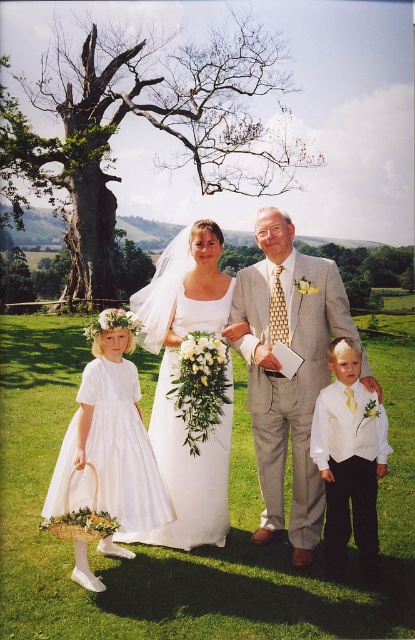
Does point (256, 214) lie behind point (348, 465)?

Yes.

Between light gray textured suit at center and white satin vest at lower right, which one appears on the left side from the viewer's perspective?

Positioned to the left is light gray textured suit at center.

Which is behind, point (310, 540) or point (334, 413)?

The point (310, 540) is behind.

This screenshot has height=640, width=415. I want to click on light gray textured suit at center, so click(x=283, y=374).

Does white satin dress at center have a greater width compared to light gray textured suit at center?

No.

Is white satin dress at center thinner than light gray textured suit at center?

Indeed, white satin dress at center has a lesser width compared to light gray textured suit at center.

The image size is (415, 640). I want to click on white satin dress at center, so click(x=249, y=376).

Does white satin dress at center have a smaller size compared to white satin vest at lower right?

Correct, white satin dress at center occupies less space than white satin vest at lower right.

The width and height of the screenshot is (415, 640). What do you see at coordinates (249, 376) in the screenshot?
I see `white satin dress at center` at bounding box center [249, 376].

This screenshot has width=415, height=640. I want to click on white satin dress at center, so click(249, 376).